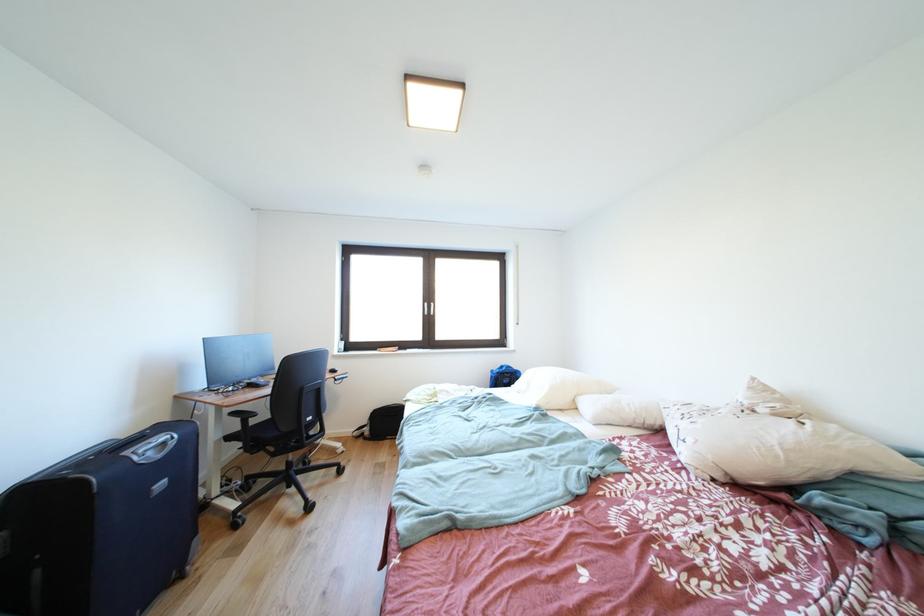
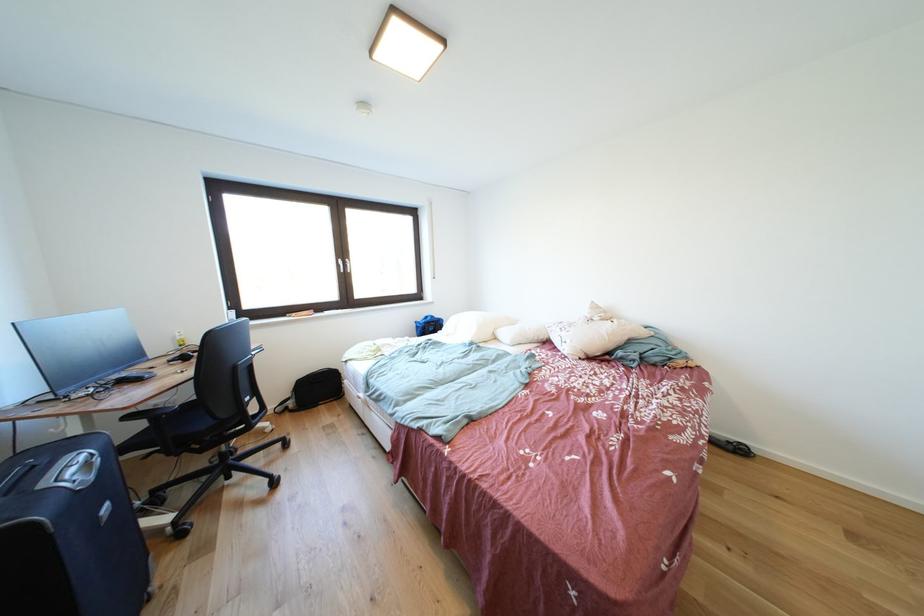
The point at (693, 428) is marked in the first image. Where is the corresponding point in the second image?

(572, 338)